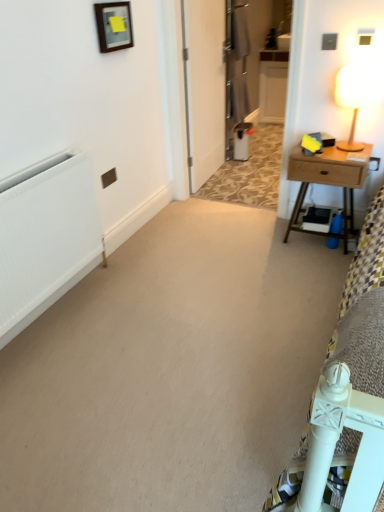
Locate an element on the screen. The height and width of the screenshot is (512, 384). spots to the right of white matte radiator at left is located at coordinates coord(154,303).